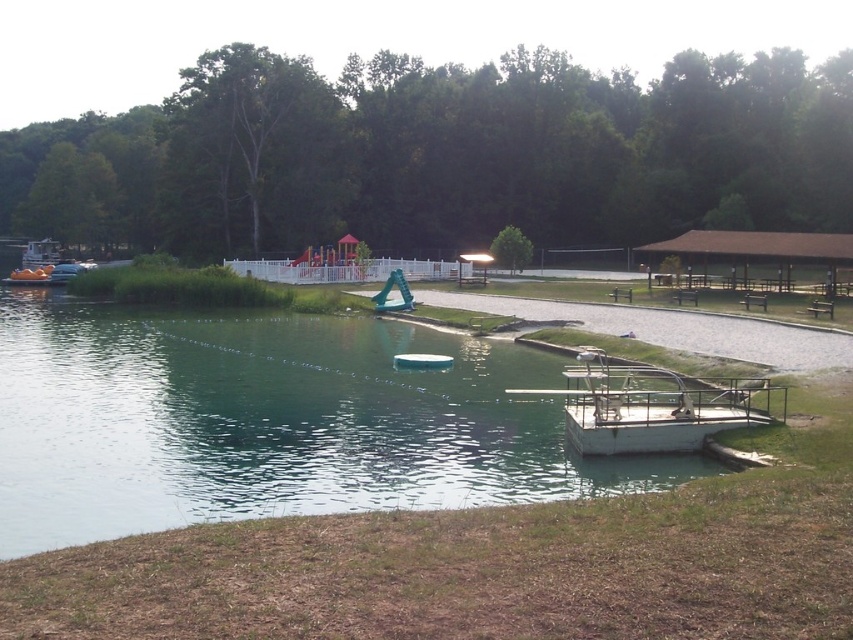
You are standing on the green metallic dock at lower right and want to reach the white plastic boat at center. Which direction should you move to get closer to the boat?

Since the green metallic dock at lower right is closer to the viewer than the white plastic boat at center, you should move forward away from the dock towards the center of the image to reach the boat.

You are standing at the center of the image and want to locate the green metallic dock at lower right. According to the coordinates provided, in which direction should you move to reach it?

The green metallic dock at lower right is located at point (x=267, y=420). Since you are at the center, you should move towards the right and downward to reach it.